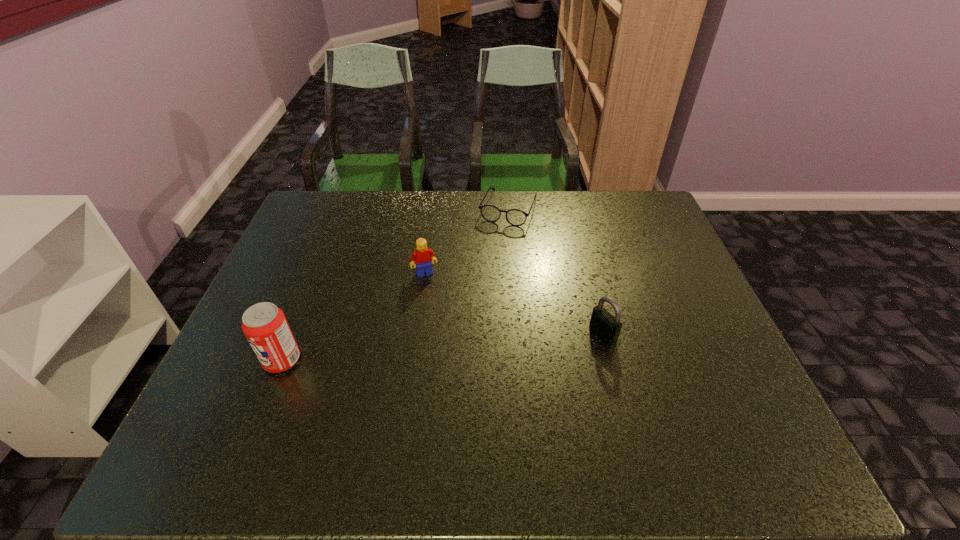
I want to click on free space on the desktop that is between the soda can and the rightmost object and is positioned on the face of the third object from right to left, so click(453, 347).

At what (x,y) coordinates should I click in order to perform the action: click on free space on the desktop that is between the tallest object and the rightmost object and is positioned on the front-facing side of the second object from right to left. Please return your answer as a coordinate pair (x, y). This screenshot has width=960, height=540. Looking at the image, I should click on (450, 347).